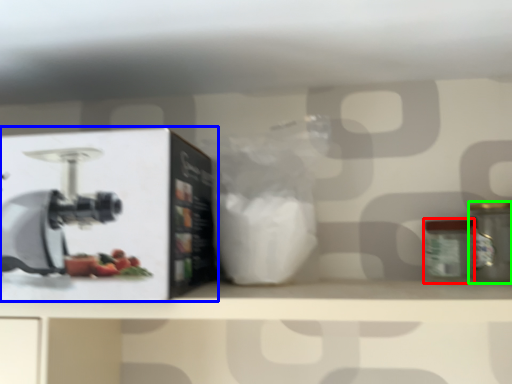
Question: Which object is the closest to the glass jar (highlighted by a red box)? Choose among these: wide (highlighted by a blue box) or kitchen appliance (highlighted by a green box).

Choices:
 (A) wide
 (B) kitchen appliance

Answer: (B)